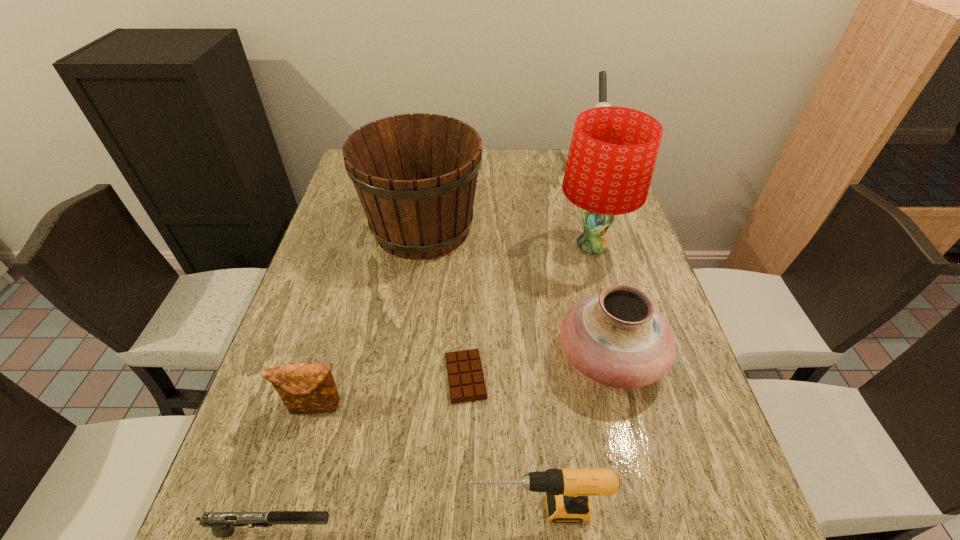
Find the location of a particular element. This screenshot has width=960, height=540. empty location between the lampshade and the clutch bag is located at coordinates (454, 327).

The image size is (960, 540). Identify the location of vacant area that lies between the gun and the fourth tallest object. (442, 444).

Locate an element on the screen. The width and height of the screenshot is (960, 540). blank region between the tallest object and the gun is located at coordinates (432, 389).

You are a GUI agent. You are given a task and a screenshot of the screen. Output one action in this format:
    pyautogui.click(x=<x>, y=<y>)
    Task: Click on the empty space that is in between the wine bucket and the seventh tallest object
    The height and width of the screenshot is (540, 960).
    Given the screenshot: What is the action you would take?
    [x=348, y=380]

At what (x,y) coordinates should I click in order to perform the action: click on the fourth closest object to the wine bucket. Please return your answer as a coordinate pair (x, y). Looking at the image, I should click on (602, 74).

Select which object appears as the third closest to the clutch bag. Please provide its 2D coordinates. Your answer should be formatted as a tuple, i.e. [(x, y)], where the tuple contains the x and y coordinates of a point satisfying the conditions above.

[(567, 490)]

Locate an element on the screen. free location that satisfies the following two spatial constraints: 1. on the front-facing side of the lampshade; 2. on the front side of the shortest object is located at coordinates (626, 376).

The height and width of the screenshot is (540, 960). Find the location of `free space that satisfies the following two spatial constraints: 1. on the open side of the clutch bag; 2. at the muzzle end of the gun`. free space that satisfies the following two spatial constraints: 1. on the open side of the clutch bag; 2. at the muzzle end of the gun is located at coordinates (280, 531).